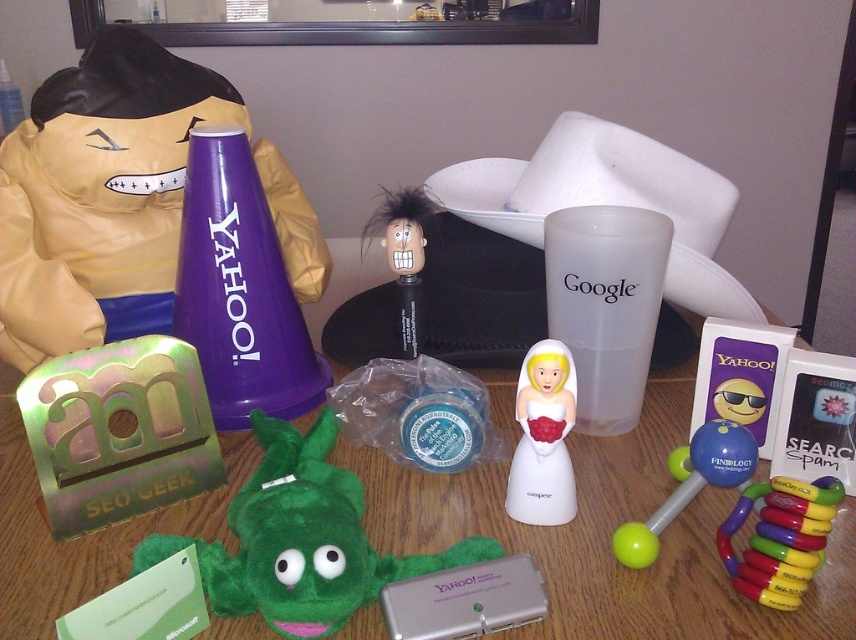
Question: Does wooden table at center have a lesser width compared to multicolored plastic baby rattle at lower right?

Choices:
 (A) yes
 (B) no

Answer: (B)

Question: Does green plush toy at center have a smaller size compared to rubber/plastic dumbbell at center-right?

Choices:
 (A) no
 (B) yes

Answer: (A)

Question: Which point is farther from the camera taking this photo?

Choices:
 (A) (119, 230)
 (B) (693, 611)

Answer: (A)

Question: Which of the following is the closest to the observer?

Choices:
 (A) tap(535, 456)
 (B) tap(723, 461)

Answer: (B)

Question: Which is nearer to the green plush toy at center?

Choices:
 (A) matte green plush toy at left
 (B) multicolored plastic baby rattle at lower right
 (C) white porcelain bride at center
 (D) rubber/plastic dumbbell at center-right

Answer: (C)

Question: Is the position of wooden table at center more distant than that of matte green plush toy at left?

Choices:
 (A) yes
 (B) no

Answer: (B)